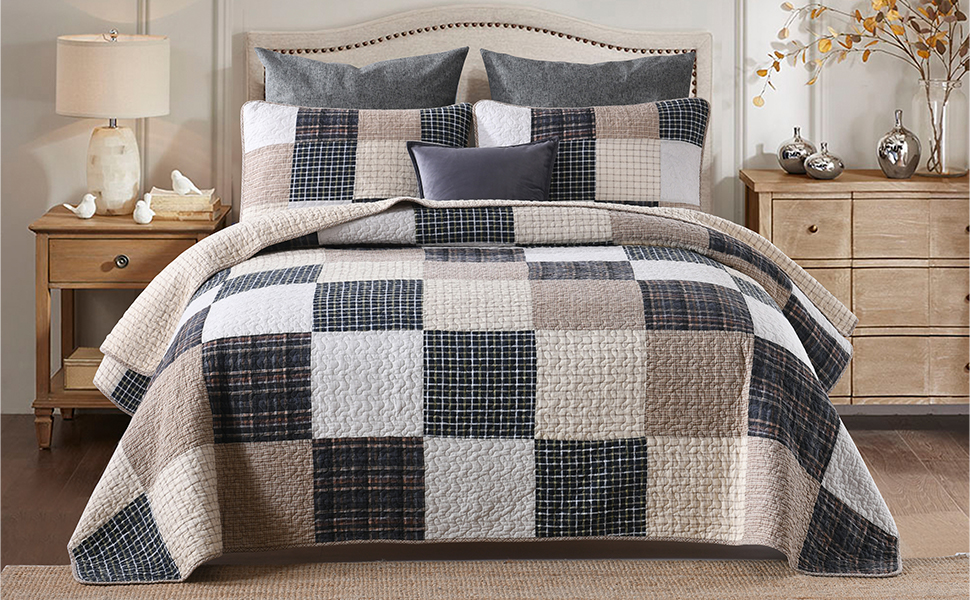
I want to click on larger bedside table, so click(x=868, y=236).